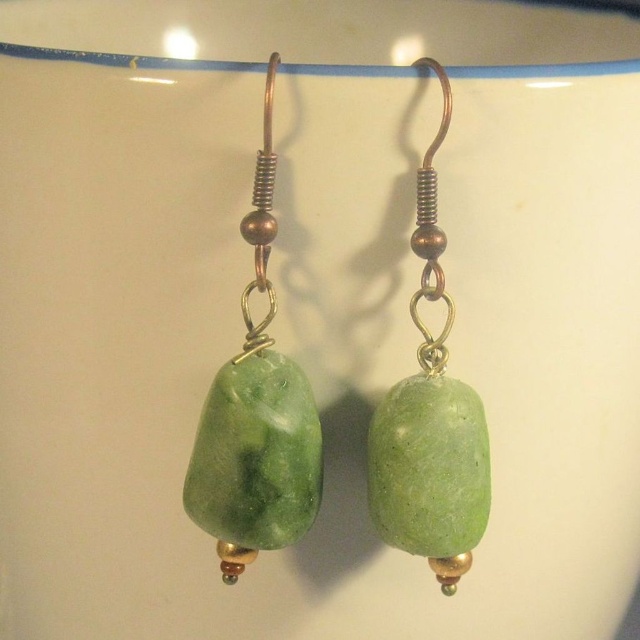
Is green stone earring at left further to the viewer compared to green stone earring at center?

No, it is in front of green stone earring at center.

Can you confirm if green stone earring at left is positioned below green stone earring at center?

No, green stone earring at left is not below green stone earring at center.

Which is in front, point (275, 460) or point (464, 467)?

Point (275, 460)

Where is `green stone earring at left`? Image resolution: width=640 pixels, height=640 pixels. green stone earring at left is located at coordinates (256, 417).